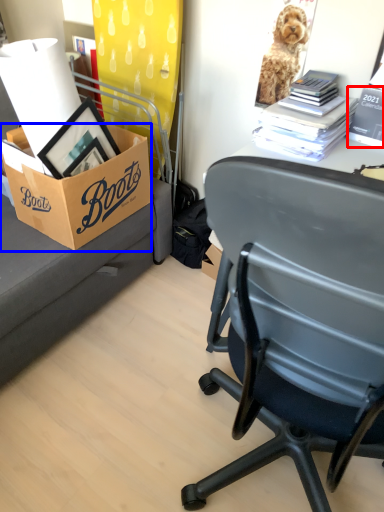
Question: Among these objects, which one is farthest to the camera, book (highlighted by a red box) or box (highlighted by a blue box)?

Choices:
 (A) book
 (B) box

Answer: (B)